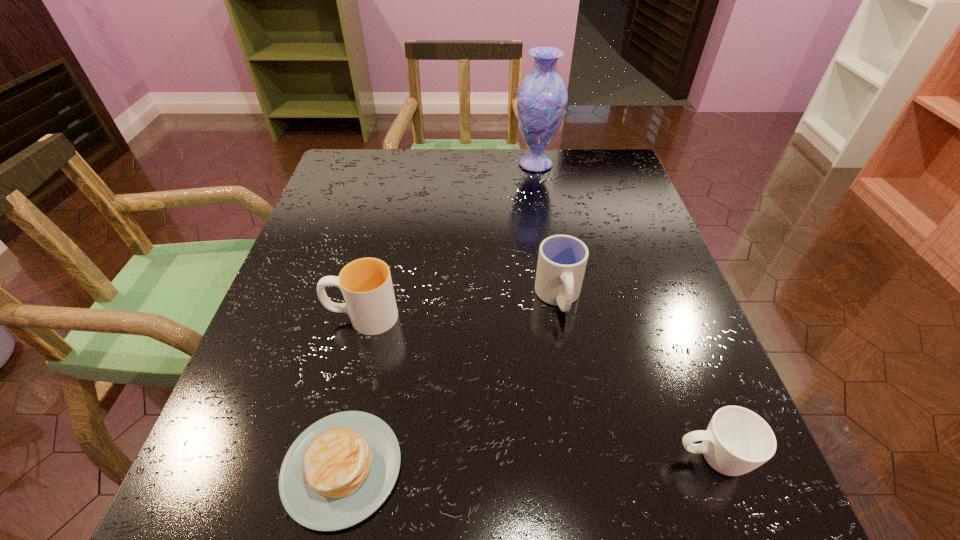
This screenshot has height=540, width=960. I want to click on object at the near right corner, so click(737, 440).

This screenshot has width=960, height=540. In order to click on vacant region at the far edge of the desktop in this screenshot , I will do `click(472, 176)`.

The image size is (960, 540). Find the location of `vacant space at the near edge`. vacant space at the near edge is located at coordinates (567, 487).

The height and width of the screenshot is (540, 960). Identify the location of free space at the left edge of the desktop. (324, 382).

The image size is (960, 540). I want to click on free location at the right edge of the desktop, so click(631, 307).

In the image, there is a desktop. Where is `blank space at the far left corner`? blank space at the far left corner is located at coordinates (372, 174).

You are a GUI agent. You are given a task and a screenshot of the screen. Output one action in this format:
    pyautogui.click(x=<x>, y=<y>)
    Task: Click on the free space at the near left corner
    Image resolution: width=960 pixels, height=540 pixels.
    Given the screenshot: What is the action you would take?
    pyautogui.click(x=203, y=509)

This screenshot has height=540, width=960. What are the coordinates of `vacant region between the second cup from left to right and the tallest object` in the screenshot? It's located at (547, 231).

Locate an element on the screen. The height and width of the screenshot is (540, 960). unoccupied area between the rightmost cup and the shortest object is located at coordinates pyautogui.click(x=526, y=463).

At what (x,y) coordinates should I click in order to perform the action: click on free space between the pancake and the second cup from left to right. Please return your answer as a coordinate pair (x, y). Looking at the image, I should click on (450, 383).